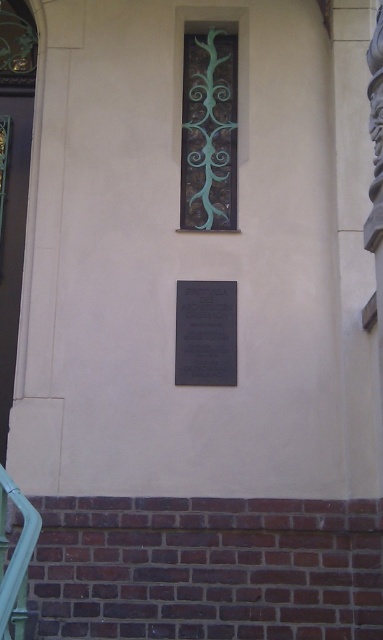
You are an architect inspecting the building facade. You notice the green glass window at center and the black polished stone plaque at center. Which object occupies a greater area on the wall?

The green glass window at center has a larger size compared to the black polished stone plaque at center, so the green glass window at center occupies a greater area on the wall.